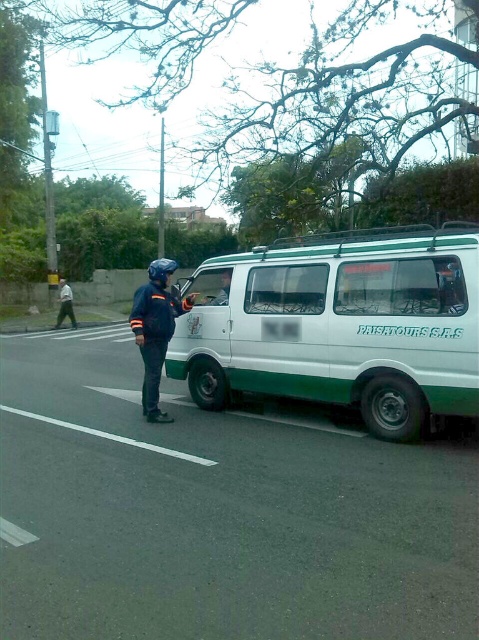
You are a pedestrian standing on the sidewalk and see the dark blue uniform at left and the matte black helmet at upper center. Which object is closer to your left side?

The dark blue uniform at left is closer to your left side because it is positioned on the left side of the matte black helmet at upper center.

You are a pedestrian standing on the sidewalk and see the white van with green accents and the person in the dark blue uniform. There are two points marked on the image. Which point is closer to you, point (x=61, y=284) or point (x=223, y=272)?

Point (x=61, y=284) is closer to you because it is further to the viewer than point (x=223, y=272).